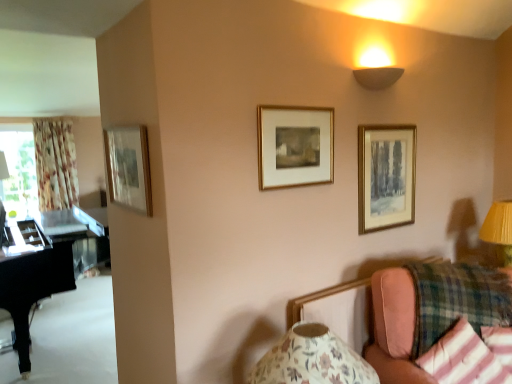
Question: Is yellow fabric lampshade at right, the first table lamp from the top, further to the viewer compared to pink fabric couch at lower right?

Choices:
 (A) no
 (B) yes

Answer: (B)

Question: From the image's perspective, is yellow fabric lampshade at right, the 2th table lamp when ordered from front to back, on top of pink fabric couch at lower right?

Choices:
 (A) no
 (B) yes

Answer: (B)

Question: From the image's perspective, is yellow fabric lampshade at right, the 1th table lamp viewed from the right, beneath pink fabric couch at lower right?

Choices:
 (A) no
 (B) yes

Answer: (A)

Question: Considering the relative sizes of yellow fabric lampshade at right, the first table lamp from the top, and pink fabric couch at lower right in the image provided, is yellow fabric lampshade at right, the first table lamp from the top, smaller than pink fabric couch at lower right?

Choices:
 (A) no
 (B) yes

Answer: (B)

Question: Considering the relative sizes of yellow fabric lampshade at right, the 2th table lamp ordered from the bottom, and pink fabric couch at lower right in the image provided, is yellow fabric lampshade at right, the 2th table lamp ordered from the bottom, taller than pink fabric couch at lower right?

Choices:
 (A) no
 (B) yes

Answer: (A)

Question: Is yellow fabric lampshade at right, the first table lamp from the top, in front of pink fabric couch at lower right?

Choices:
 (A) yes
 (B) no

Answer: (B)

Question: Does matte beige wall sconce at upper right lie behind gold-framed painting at upper right, positioned as the first picture frame in right-to-left order?

Choices:
 (A) yes
 (B) no

Answer: (B)

Question: Would you consider matte beige wall sconce at upper right to be distant from gold-framed painting at upper right, positioned as the first picture frame in right-to-left order?

Choices:
 (A) no
 (B) yes

Answer: (A)

Question: Considering the relative sizes of matte beige wall sconce at upper right and gold-framed painting at upper right, the 3th picture frame from the left, in the image provided, is matte beige wall sconce at upper right shorter than gold-framed painting at upper right, the 3th picture frame from the left,?

Choices:
 (A) yes
 (B) no

Answer: (A)

Question: Is matte beige wall sconce at upper right oriented towards gold-framed painting at upper right, the 3th picture frame from the left?

Choices:
 (A) no
 (B) yes

Answer: (A)

Question: Is matte beige wall sconce at upper right bigger than gold-framed painting at upper right, positioned as the first picture frame in right-to-left order?

Choices:
 (A) no
 (B) yes

Answer: (A)

Question: Does matte beige wall sconce at upper right have a smaller size compared to gold-framed painting at upper right, positioned as the first picture frame in right-to-left order?

Choices:
 (A) yes
 (B) no

Answer: (A)

Question: From the image's perspective, does floral fabric curtain at left appear lower than pink fabric couch at lower right?

Choices:
 (A) yes
 (B) no

Answer: (B)